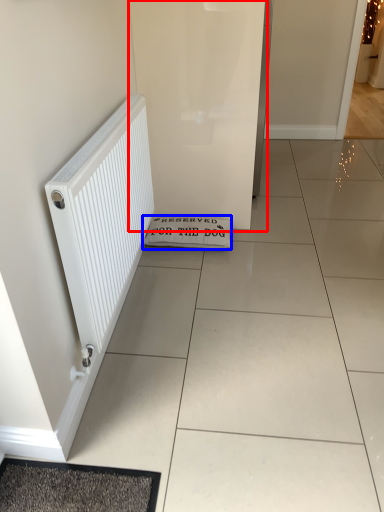
Question: Which point is further to the camera, screen door (highlighted by a red box) or doormat (highlighted by a blue box)?

Choices:
 (A) screen door
 (B) doormat

Answer: (B)